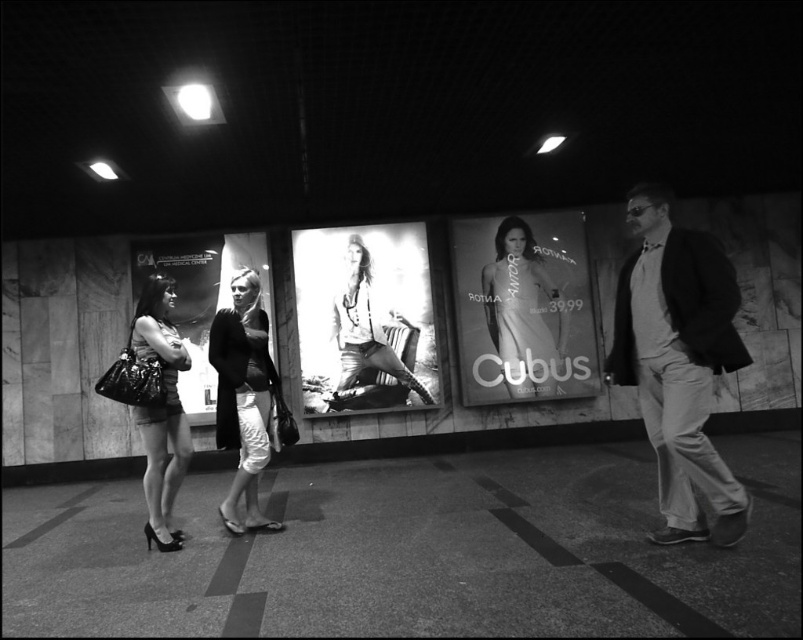
Question: Does smooth concrete pavement at lower center appear over silky white dress at center?

Choices:
 (A) yes
 (B) no

Answer: (B)

Question: Does silky white dress at center lie behind smooth leather jacket at center?

Choices:
 (A) no
 (B) yes

Answer: (B)

Question: Among these points, which one is nearest to the camera?

Choices:
 (A) tap(537, 264)
 (B) tap(769, 538)

Answer: (B)

Question: Which point is closer to the camera taking this photo?

Choices:
 (A) (687, 285)
 (B) (524, 296)

Answer: (A)

Question: Which point is farther to the camera?

Choices:
 (A) coord(353,237)
 (B) coord(679,344)
 (C) coord(510,326)
 (D) coord(226,554)

Answer: (C)

Question: Observing the image, what is the correct spatial positioning of smooth concrete pavement at lower center in reference to matte black coat at center?

Choices:
 (A) left
 (B) right

Answer: (B)